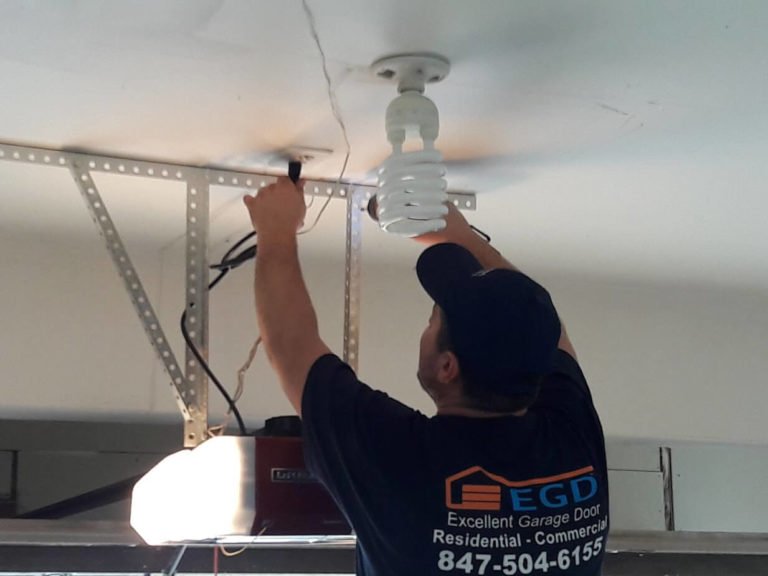
Locate an element on the screen. Image resolution: width=768 pixels, height=576 pixels. wall is located at coordinates (697, 485), (61, 492).